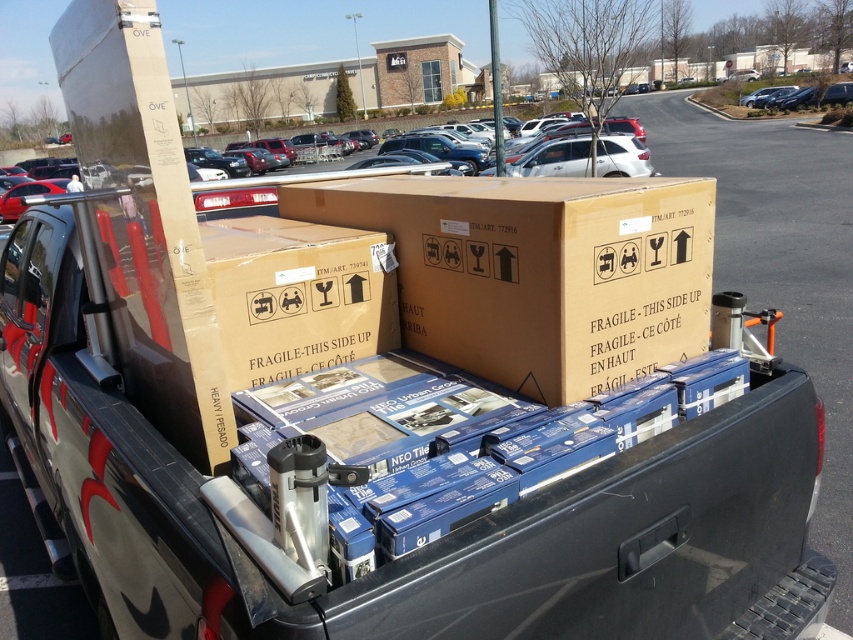
Question: Among these objects, which one is nearest to the camera?

Choices:
 (A) brown cardboard box at center
 (B) white matte suv at center

Answer: (A)

Question: Does brown cardboard box at center appear over white matte suv at center?

Choices:
 (A) no
 (B) yes

Answer: (A)

Question: Which point is farther to the camera?

Choices:
 (A) (598, 168)
 (B) (294, 195)

Answer: (A)

Question: Does brown cardboard box at center have a greater width compared to white matte suv at center?

Choices:
 (A) yes
 (B) no

Answer: (B)

Question: From the image, what is the correct spatial relationship of brown cardboard box at center in relation to white matte suv at center?

Choices:
 (A) left
 (B) right

Answer: (A)